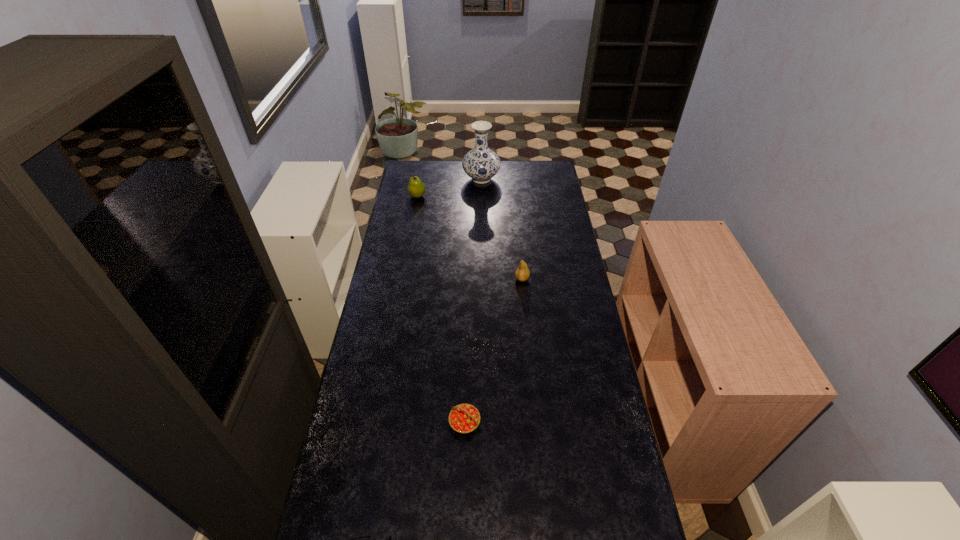
At what (x,y) coordinates should I click in order to perform the action: click on free spot between the tallest object and the rightmost object. Please return your answer as a coordinate pair (x, y). The width and height of the screenshot is (960, 540). Looking at the image, I should click on (502, 229).

Locate an element on the screen. The image size is (960, 540). empty space that is in between the strawberry and the shorter pear is located at coordinates (493, 350).

At what (x,y) coordinates should I click in order to perform the action: click on vacant region between the tallest object and the farther pear. Please return your answer as a coordinate pair (x, y). The width and height of the screenshot is (960, 540). Looking at the image, I should click on (449, 187).

Find the location of `vacant space that is in between the rightmost object and the left pear`. vacant space that is in between the rightmost object and the left pear is located at coordinates (469, 238).

Where is `vacant region between the second shortest object and the farthest object`? The height and width of the screenshot is (540, 960). vacant region between the second shortest object and the farthest object is located at coordinates (473, 301).

Select which object is the third closest to the spectacles. Please provide its 2D coordinates. Your answer should be formatted as a tuple, i.e. [(x, y)], where the tuple contains the x and y coordinates of a point satisfying the conditions above.

[(416, 188)]

Identify which object is the second nearest to the shortest object. Please provide its 2D coordinates. Your answer should be formatted as a tuple, i.e. [(x, y)], where the tuple contains the x and y coordinates of a point satisfying the conditions above.

[(522, 273)]

Identify the location of free space that satisfies the following two spatial constraints: 1. on the front side of the third tallest object; 2. on the left side of the tallest object. The width and height of the screenshot is (960, 540). (482, 279).

The height and width of the screenshot is (540, 960). I want to click on vacant position in the image that satisfies the following two spatial constraints: 1. on the front side of the farthest object; 2. on the left side of the rightmost object, so click(482, 279).